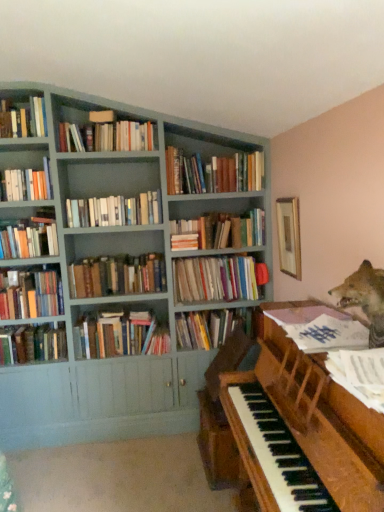
Question: Choose the correct answer: Is hardcover books at center, the eleventh book positioned from the bottom, inside white paper music at right, arranged as the eleventh book when viewed from the top, or outside it?

Choices:
 (A) inside
 (B) outside

Answer: (B)

Question: Is hardcover books at center, the fifth book in the top-to-bottom sequence, wider or thinner than white paper music at right, arranged as the eleventh book when viewed from the top?

Choices:
 (A) thin
 (B) wide

Answer: (A)

Question: Estimate the real-world distances between objects in this image. Which object is closer to the hardcover books at upper left, placed as the first book when sorted from top to bottom?

Choices:
 (A) matte gray bookcase at upper left
 (B) hardcover books at center, the thirteenth book from the bottom
 (C) hardcover book at upper left, arranged as the twelfth book when ordered from the bottom
 (D) shiny brown fox at upper right
 (E) wooden picture frame at upper right

Answer: (C)

Question: Estimate the real-world distances between objects in this image. Which object is farther from the hardcover books at center, the tenth book positioned from the bottom?

Choices:
 (A) hardcover books at upper center, the second book from the top
 (B) hardcover books at upper left, placed as the first book when sorted from top to bottom
 (C) hardcover books at center, placed as the third book when sorted from top to bottom
 (D) hardcover books at center, the 2th book when ordered from bottom to top
 (E) hardcover books at center, the seventh book from the bottom

Answer: (B)